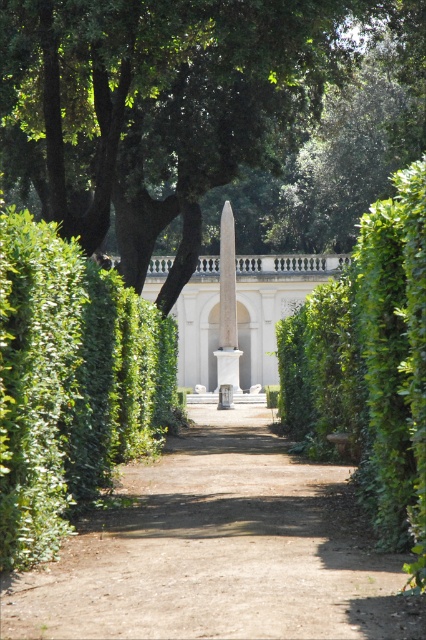
Consider the image. Which of these two, green leafy tree at center or dirt path at center, stands taller?

green leafy tree at center is taller.

Is point (154, 90) farther from viewer compared to point (106, 592)?

Yes, point (154, 90) is farther from viewer.

Which is in front, point (402, 4) or point (201, 632)?

Positioned in front is point (201, 632).

Locate an element on the screen. green leafy tree at center is located at coordinates (206, 113).

Does dirt path at center appear under green leafy hedge at center?

Indeed, dirt path at center is positioned under green leafy hedge at center.

Is point (245, 634) positioned after point (382, 432)?

No, it is in front of (382, 432).

Which is in front, point (324, 580) or point (317, 404)?

Point (324, 580) is more forward.

Identify the location of dirt path at center. This screenshot has width=426, height=640. (221, 548).

Is point (143, 595) positioned before point (14, 416)?

Yes.

From the picture: Can you confirm if dirt path at center is positioned to the left of green leafy hedge at left?

In fact, dirt path at center is to the right of green leafy hedge at left.

Who is more distant from viewer, (135, 532) or (106, 362)?

The point (106, 362) is more distant.

The height and width of the screenshot is (640, 426). What are the coordinates of `dirt path at center` in the screenshot? It's located at click(221, 548).